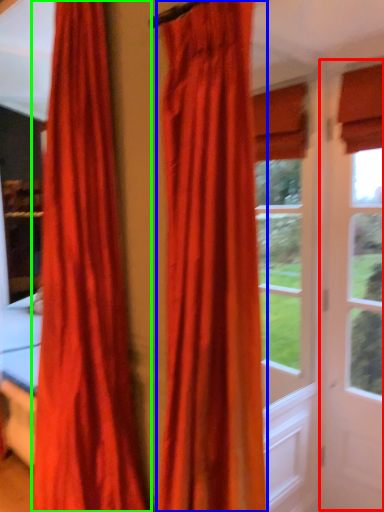
Question: Which is nearer to the screen door (highlighted by a red box)? curtain (highlighted by a blue box) or curtain (highlighted by a green box).

Choices:
 (A) curtain
 (B) curtain

Answer: (A)